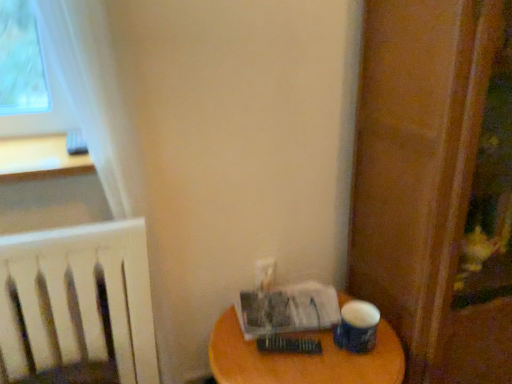
Where is `free space in front of blue matte paper cup at lower right`? The height and width of the screenshot is (384, 512). free space in front of blue matte paper cup at lower right is located at coordinates (362, 372).